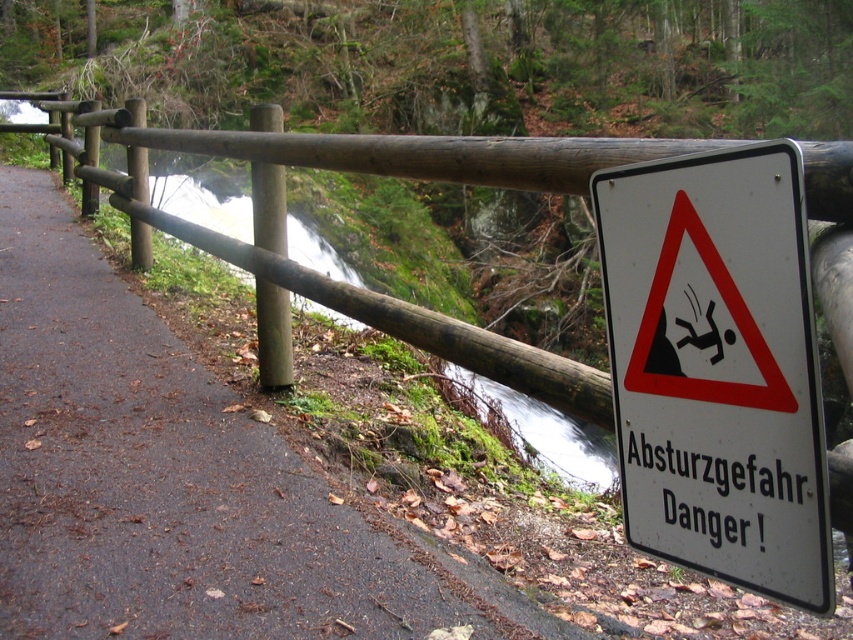
Is white plastic sign at right smaller than green mossy creek at left?

Yes, white plastic sign at right is smaller than green mossy creek at left.

Is the position of white plastic sign at right less distant than that of green mossy creek at left?

Yes.

The width and height of the screenshot is (853, 640). I want to click on white plastic sign at right, so click(x=717, y=368).